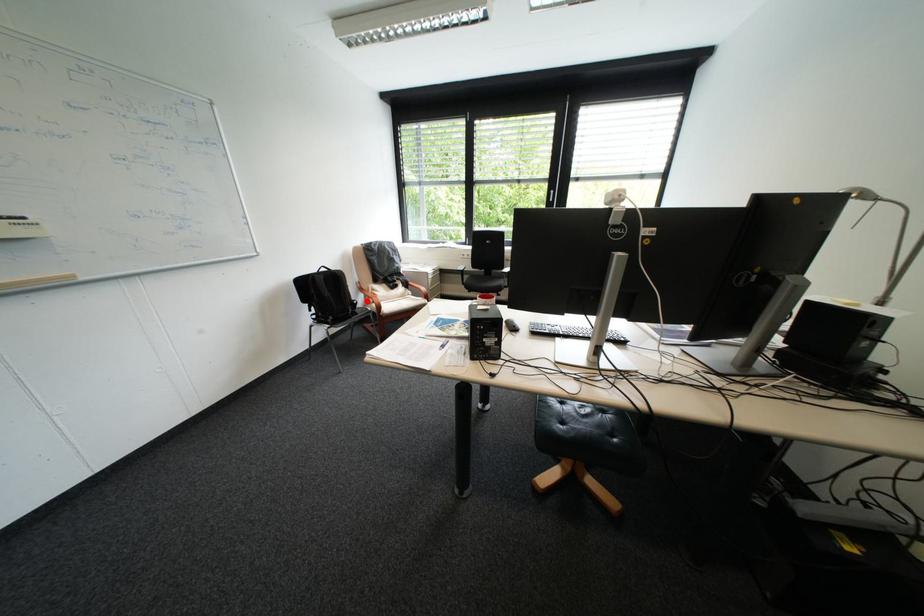
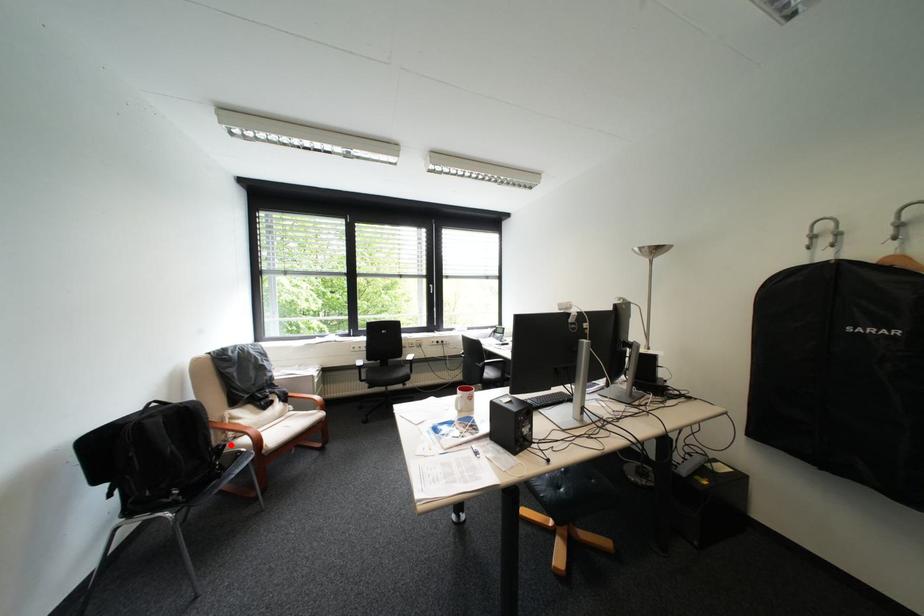
I am providing you with two images of the same scene from different viewpoints. A red point is marked on the first image and another point is marked on the second image. Are the points marked in image1 and image2 representing the same 3D position?

Yes